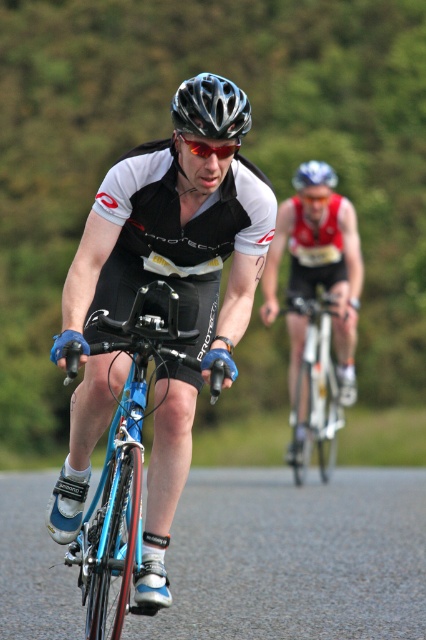
Which is in front, point (117, 577) or point (224, 156)?

Point (224, 156) is more forward.

Identify the location of blue metallic bicycle at center. (123, 467).

Image resolution: width=426 pixels, height=640 pixels. What do you see at coordinates (123, 467) in the screenshot?
I see `blue metallic bicycle at center` at bounding box center [123, 467].

Find the location of `blue metallic bicycle at center`. blue metallic bicycle at center is located at coordinates (123, 467).

Can you confirm if shiny silver bicycle at center is thinner than blue matte helmet at upper center?

Correct, shiny silver bicycle at center's width is less than blue matte helmet at upper center's.

Based on the photo, does shiny silver bicycle at center lie behind blue matte helmet at upper center?

No, it is not.

Image resolution: width=426 pixels, height=640 pixels. Identify the location of shiny silver bicycle at center. (316, 392).

Does matte black cycling jersey at center have a smaller size compared to blue metallic bicycle at center?

Correct, matte black cycling jersey at center occupies less space than blue metallic bicycle at center.

Find the location of a particular element. This screenshot has height=640, width=426. matte black cycling jersey at center is located at coordinates (178, 314).